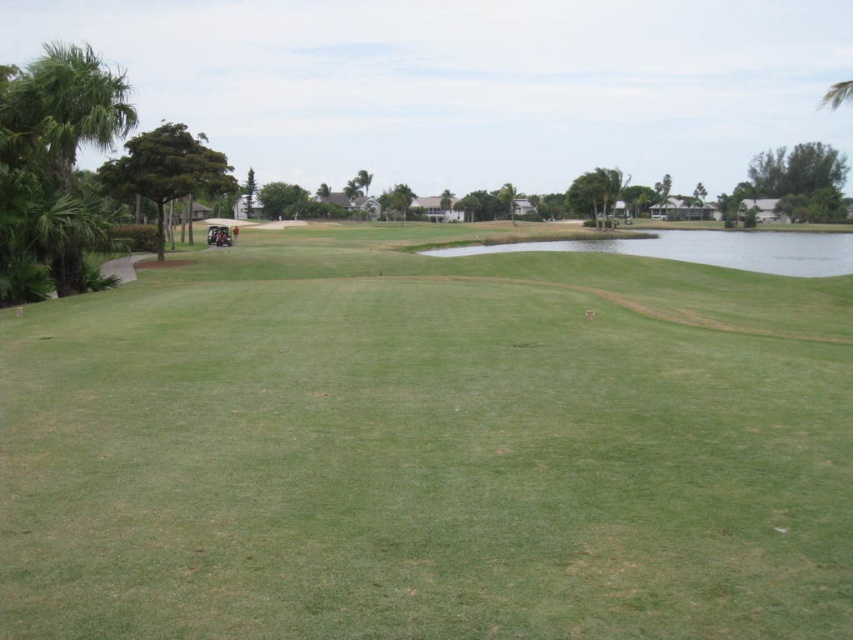
Between point (187, 292) and point (61, 211), which one is positioned behind?

The point (187, 292) is behind.

Between green grassy golf course at center and green leafy palm tree at left, which one is positioned higher?

Positioned higher is green leafy palm tree at left.

Which is in front, point (202, 268) or point (68, 230)?

Point (68, 230) is in front.

The width and height of the screenshot is (853, 640). Identify the location of green grassy golf course at center. (427, 449).